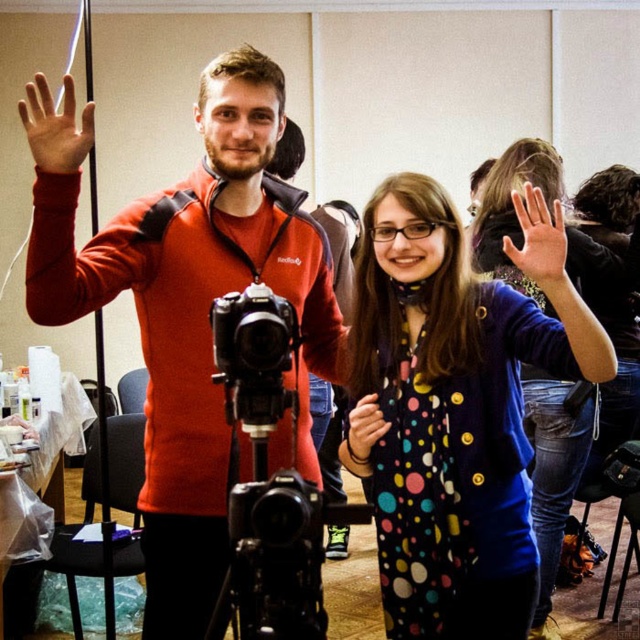
Which is in front, point (262, 531) or point (346, 438)?

Positioned in front is point (262, 531).

Is black plastic tripod at center positioned at the back of polka dot fabric hand at center?

No, it is in front of polka dot fabric hand at center.

Who is more forward, (289, 532) or (364, 449)?

Point (289, 532)

I want to click on black plastic tripod at center, so click(272, 556).

Can you confirm if light brown skin at center is positioned to the right of polka dot fabric hand at center?

Correct, you'll find light brown skin at center to the right of polka dot fabric hand at center.

Based on the photo, can you confirm if light brown skin at center is wider than polka dot fabric hand at center?

Indeed, light brown skin at center has a greater width compared to polka dot fabric hand at center.

Where is `light brown skin at center`? The height and width of the screenshot is (640, 640). light brown skin at center is located at coordinates (540, 241).

Which is in front, point (433, 568) or point (356, 449)?

Point (433, 568) is more forward.

Can you confirm if polka dot fabric dress at center is positioned below polka dot fabric hand at center?

No.

Between point (536, 241) and point (376, 397), which one is positioned behind?

The point (376, 397) is more distant.

At what (x,y) coordinates should I click in order to perform the action: click on polka dot fabric dress at center. Please return your answer as a coordinate pair (x, y). The image size is (640, 640). Looking at the image, I should click on click(458, 406).